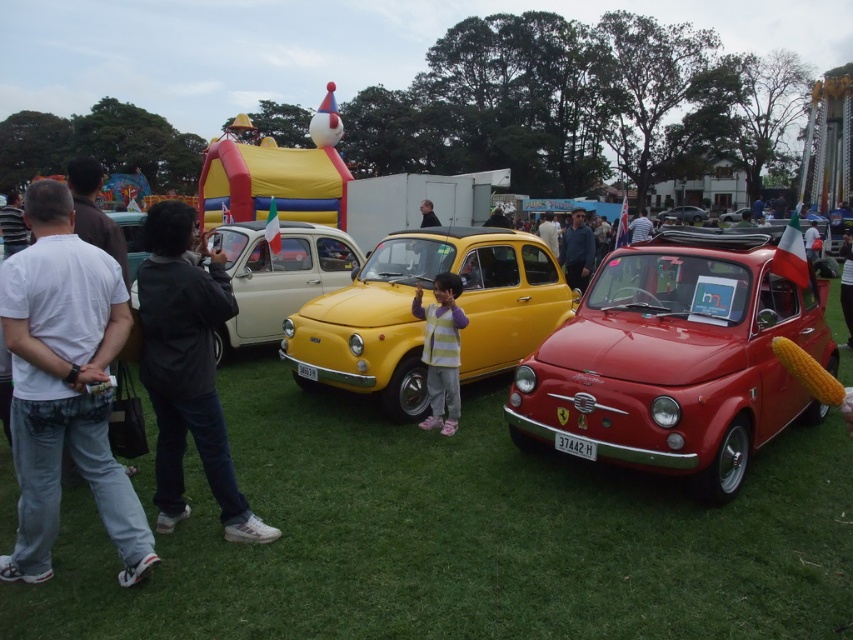
Question: Is blue denim jeans at center further to camera compared to metallic silver car at center?

Choices:
 (A) no
 (B) yes

Answer: (A)

Question: Can you confirm if white cotton shirt at left is wider than dark gray jacket at center?

Choices:
 (A) no
 (B) yes

Answer: (B)

Question: Which of these objects is positioned closest to the dark gray jacket at center?

Choices:
 (A) white cotton shirt at left
 (B) matte yellow car at center

Answer: (A)

Question: Which object is the closest to the dark gray jacket at center?

Choices:
 (A) metallic silver car at center
 (B) blue denim jeans at center
 (C) striped fabric dress at center

Answer: (C)

Question: Can you confirm if white cotton shirt at left is positioned below matte yellow car at center?

Choices:
 (A) no
 (B) yes

Answer: (B)

Question: Which point is farther to the camera?

Choices:
 (A) (341, 358)
 (B) (648, 330)
 (C) (177, 400)
 (D) (851, 248)

Answer: (D)